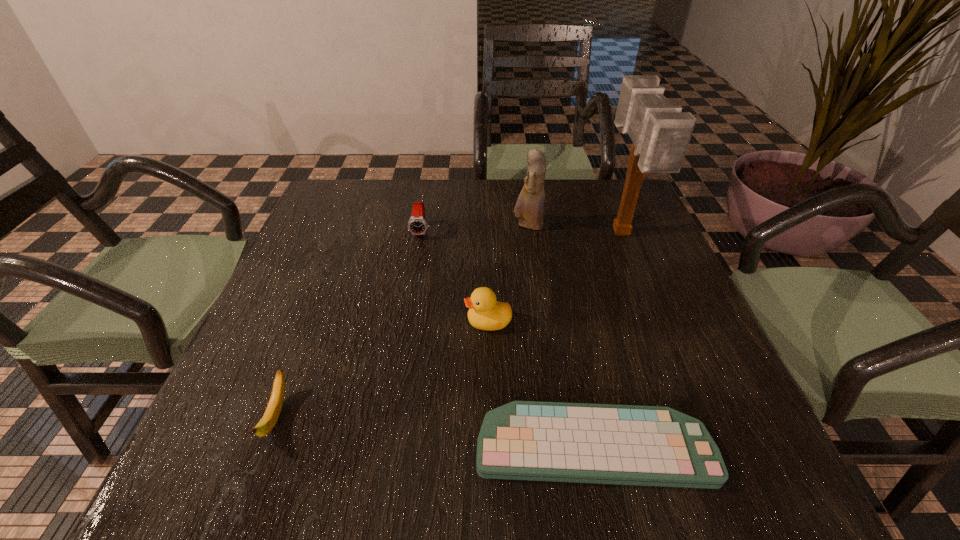
This screenshot has height=540, width=960. What are the coordinates of `banana that is at the near edge` in the screenshot? It's located at (266, 424).

Identify the location of computer keyboard that is at the near edge. Image resolution: width=960 pixels, height=540 pixels. (523, 440).

At what (x,y) coordinates should I click in order to perform the action: click on object that is at the left edge. Please return your answer as a coordinate pair (x, y). This screenshot has width=960, height=540. Looking at the image, I should click on (266, 424).

Identify the location of mallet positioned at the right edge. The image size is (960, 540). (660, 132).

Locate an element on the screen. computer keyboard that is at the right edge is located at coordinates (523, 440).

At what (x,y) coordinates should I click in order to perform the action: click on object located at the near left corner. Please return your answer as a coordinate pair (x, y). The height and width of the screenshot is (540, 960). Looking at the image, I should click on (266, 424).

Where is `object that is at the far right corner`? The image size is (960, 540). object that is at the far right corner is located at coordinates click(660, 132).

Where is `object that is at the near right corner`? Image resolution: width=960 pixels, height=540 pixels. object that is at the near right corner is located at coordinates (523, 440).

The image size is (960, 540). Identify the location of vacant space at the far edge of the desktop. (486, 187).

This screenshot has height=540, width=960. Identify the location of free space at the left edge of the desktop. (331, 254).